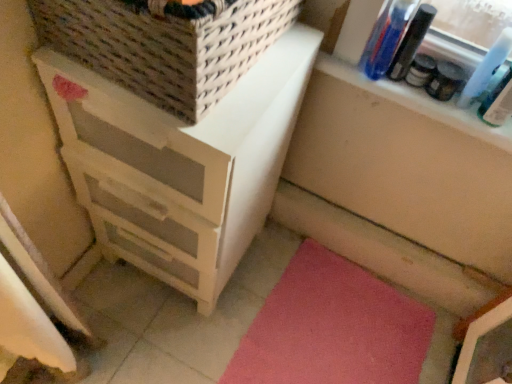
Find the location of a particular element. This screenshot has height=384, width=512. vacant region to the left of pink carpet at lower right is located at coordinates (181, 316).